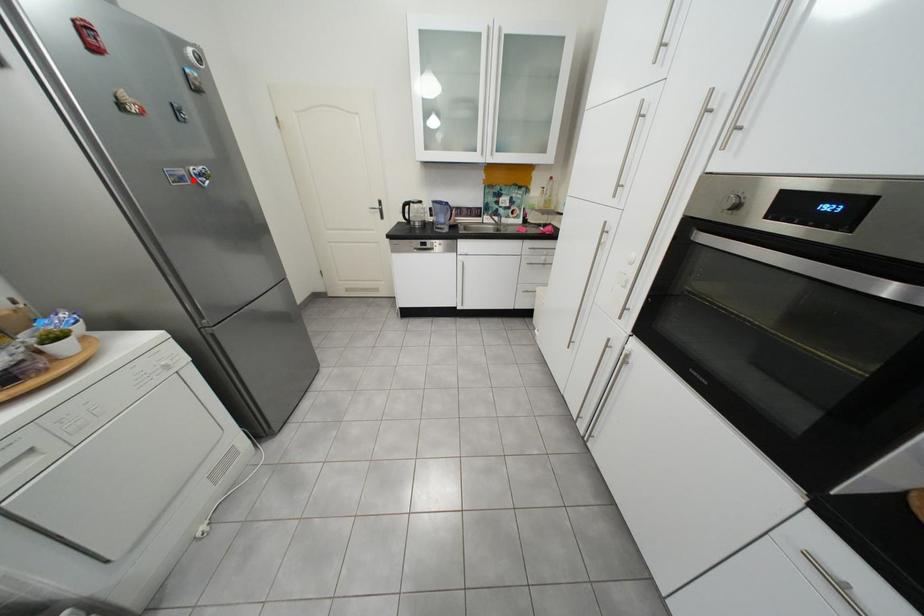
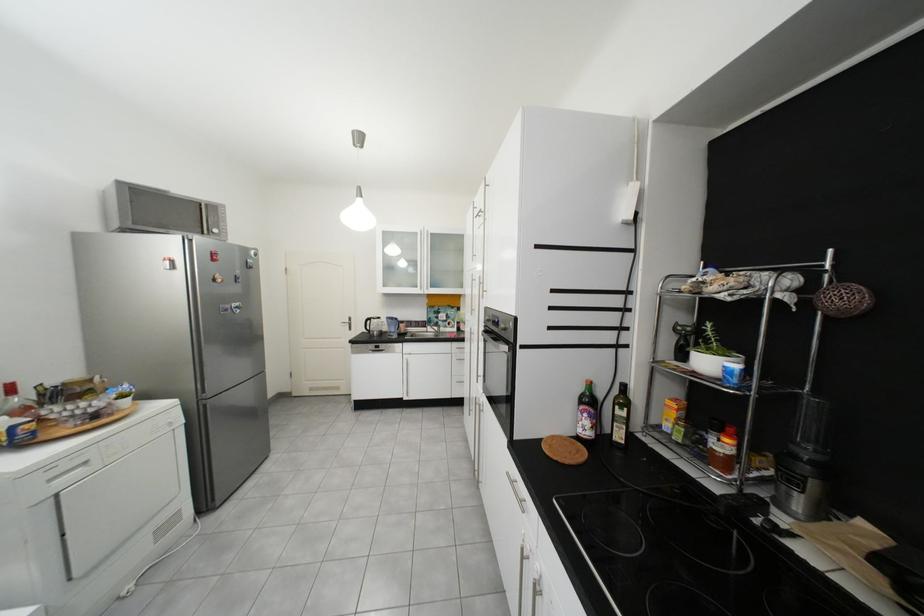
Locate, in the second image, the point that corresponds to the highlighted location in the first image.

(237, 310)